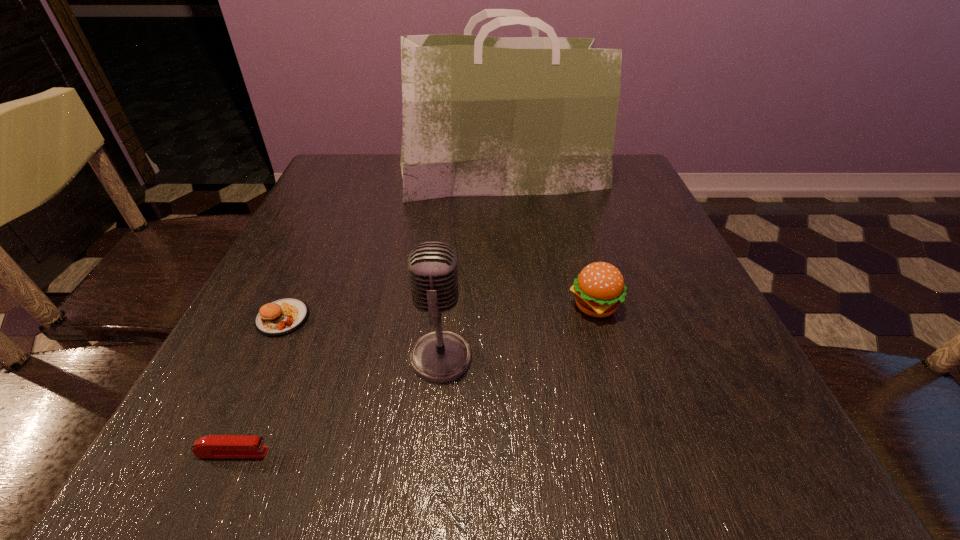
You are a GUI agent. You are given a task and a screenshot of the screen. Output one action in this format:
    pyautogui.click(x=<x>, y=<y>)
    Task: Click on the vacant space situated on the back of the second shortest object
    
    Given the screenshot: What is the action you would take?
    pyautogui.click(x=306, y=267)

Identify the location of vacant region located 0.190m on the front-facing side of the stapler. (415, 453).

The width and height of the screenshot is (960, 540). In order to click on object located at the far edge in this screenshot , I will do `click(482, 116)`.

At what (x,y) coordinates should I click in order to perform the action: click on object that is at the near edge. Please return your answer as a coordinate pair (x, y). Looking at the image, I should click on (212, 446).

Locate an element on the screen. patty that is positioned at the left edge is located at coordinates (280, 317).

Find the location of a particular element. This screenshot has height=540, width=960. stapler that is at the left edge is located at coordinates (212, 446).

The height and width of the screenshot is (540, 960). Identify the location of grocery bag at the right edge. (482, 116).

I want to click on hamburger positioned at the right edge, so click(599, 288).

Find the location of `object located at the near left corner`. object located at the near left corner is located at coordinates (212, 446).

Where is `object present at the far right corner`? This screenshot has width=960, height=540. object present at the far right corner is located at coordinates (482, 116).